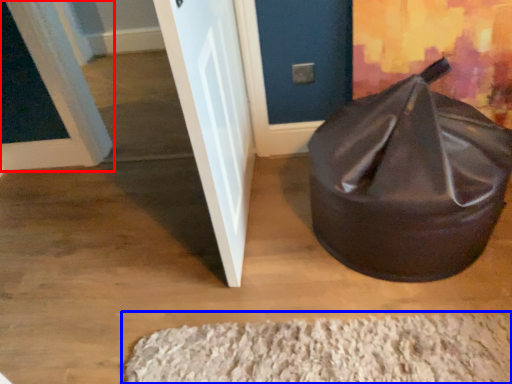
Question: Which object appears closest to the camera in this image, door (highlighted by a red box) or doormat (highlighted by a blue box)?

Choices:
 (A) door
 (B) doormat

Answer: (B)